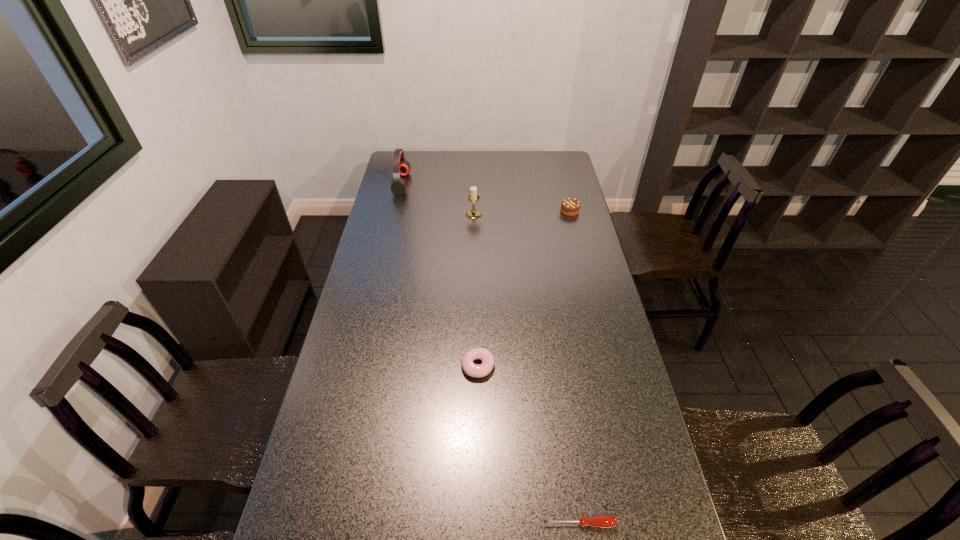
Where is `object that stands as the fourth closest to the second tallest object`? This screenshot has width=960, height=540. object that stands as the fourth closest to the second tallest object is located at coordinates point(604,521).

Where is `free spot that satisfies the following two spatial constraints: 1. on the back side of the shortest object; 2. on the ear cups of the earphone`? free spot that satisfies the following two spatial constraints: 1. on the back side of the shortest object; 2. on the ear cups of the earphone is located at coordinates (529, 184).

Locate an element on the screen. This screenshot has height=540, width=960. free space that satisfies the following two spatial constraints: 1. on the ear cups of the leftmost object; 2. on the left side of the fourth tallest object is located at coordinates (359, 367).

I want to click on vacant space that satisfies the following two spatial constraints: 1. on the back side of the fourth farthest object; 2. on the ear cups of the tallest object, so (x=478, y=184).

Identify the location of vacant position in the image that satisfies the following two spatial constraints: 1. on the ear cups of the fourth tallest object; 2. on the left side of the tallest object. The width and height of the screenshot is (960, 540). (359, 367).

This screenshot has width=960, height=540. What are the coordinates of `free region that satisfies the following two spatial constraints: 1. on the back side of the second tallest object; 2. on the ear cups of the tallest object` in the screenshot? It's located at (474, 184).

Find the location of a particular element. The image size is (960, 540). vacant space that satisfies the following two spatial constraints: 1. on the ear cups of the tallest object; 2. on the back side of the third tallest object is located at coordinates (396, 211).

Identify the location of free space that satisfies the following two spatial constraints: 1. on the back side of the second tallest object; 2. on the left side of the rightmost object. (473, 211).

The image size is (960, 540). In order to click on free space that satisfies the following two spatial constraints: 1. on the back side of the candle holder; 2. on the ear cups of the farthest object in this screenshot , I will do `click(474, 184)`.

You are a GUI agent. You are given a task and a screenshot of the screen. Output one action in this format:
    pyautogui.click(x=<x>, y=<y>)
    Task: Click on the vacant space that satisfies the following two spatial constraints: 1. on the ear cups of the fourth object from left to right; 2. on the right side of the leftmost object
    The width and height of the screenshot is (960, 540).
    Given the screenshot: What is the action you would take?
    pyautogui.click(x=323, y=523)